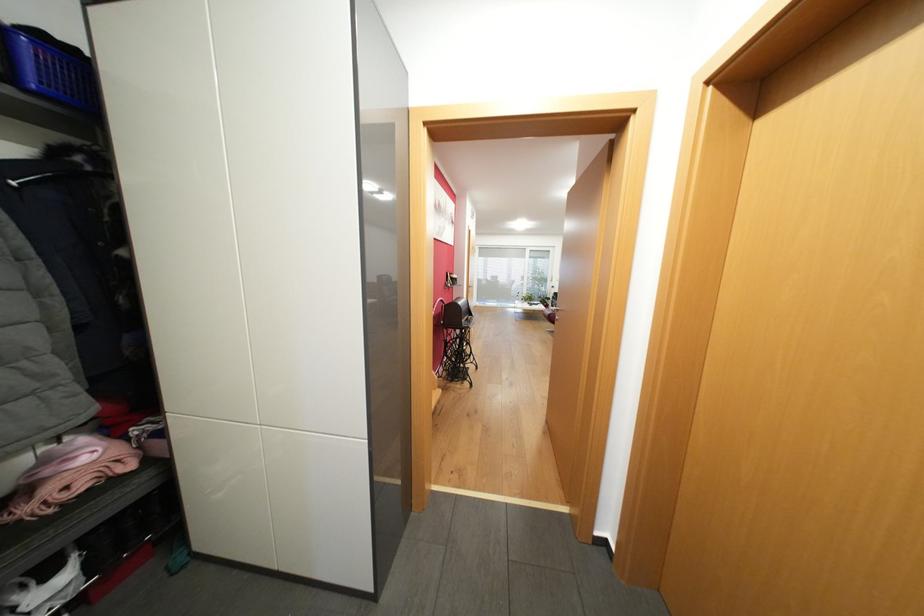
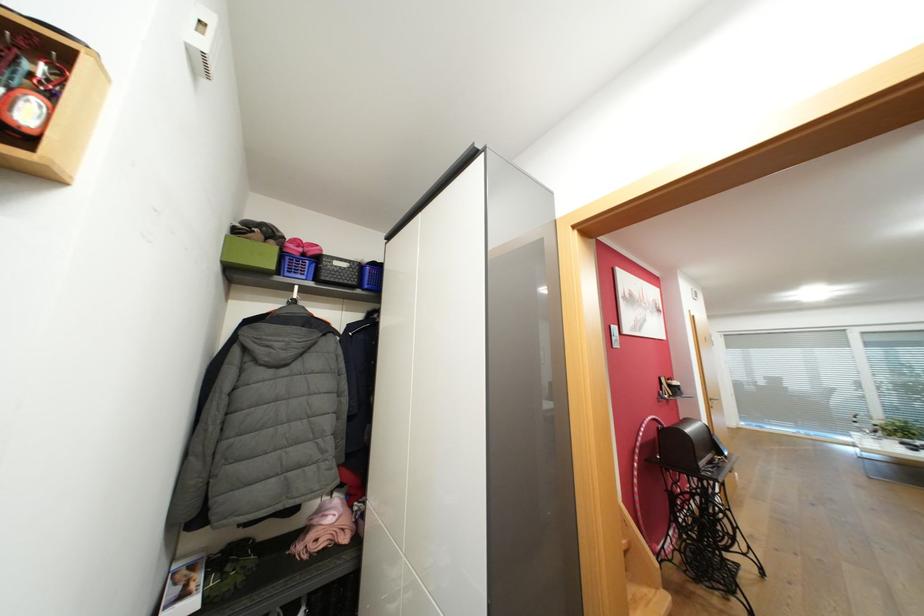
Locate, in the second image, the point that corresponds to point (432, 123) in the first image.

(580, 227)